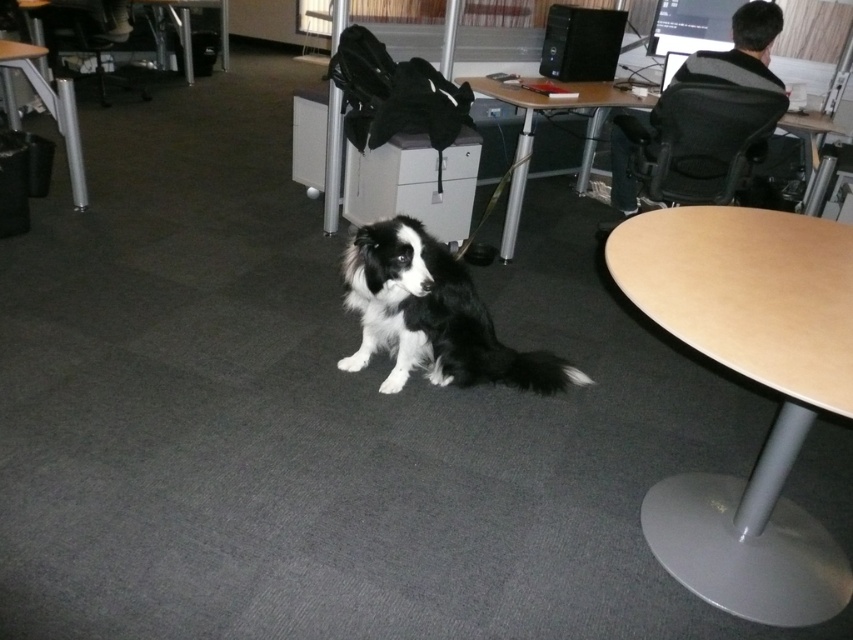
Question: Which is farther from the wooden table at upper center?

Choices:
 (A) black plastic computer tower at upper center
 (B) light brown wood round table at lower right

Answer: (B)

Question: Is black/white fur dog at center to the right of metallic black chair at upper left from the viewer's perspective?

Choices:
 (A) yes
 (B) no

Answer: (A)

Question: Estimate the real-world distances between objects in this image. Which object is farther from the black/white fur dog at center?

Choices:
 (A) metallic gray table at lower left
 (B) black plastic computer tower at upper center
 (C) metallic black chair at upper left
 (D) light brown wood round table at lower right

Answer: (C)

Question: Is the position of black/white fur dog at center more distant than that of black plastic computer tower at upper center?

Choices:
 (A) no
 (B) yes

Answer: (A)

Question: Among these objects, which one is nearest to the camera?

Choices:
 (A) metallic gray table at lower left
 (B) wooden table at upper center
 (C) black fabric swivel chair at right

Answer: (C)

Question: Does black plastic computer tower at upper center appear under metallic black chair at upper left?

Choices:
 (A) no
 (B) yes

Answer: (B)